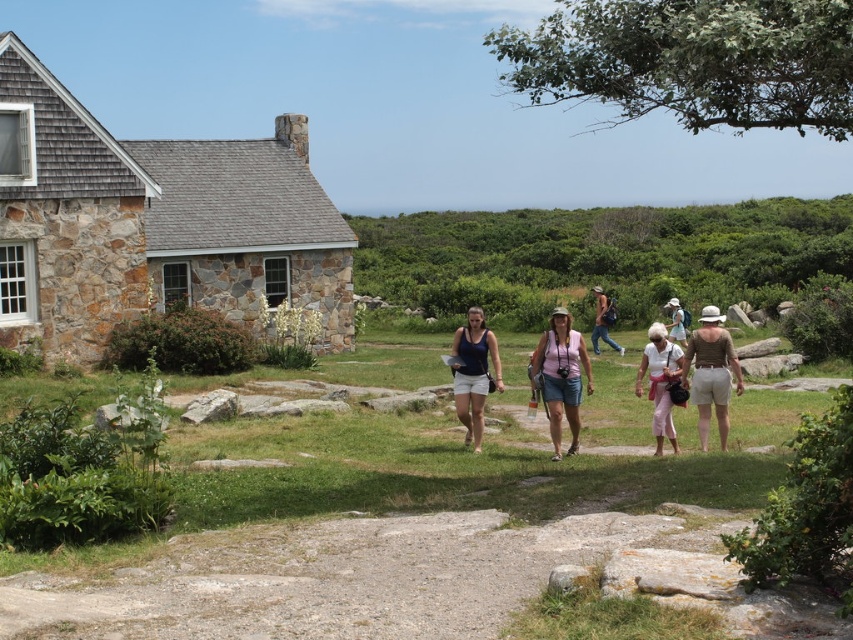
Is pink fabric shirt at center positioned in front of matte white hat at center?

Yes, pink fabric shirt at center is closer to the viewer.

Is point (564, 308) positioned after point (677, 300)?

Yes, it is behind point (677, 300).

What do you see at coordinates (561, 376) in the screenshot? This screenshot has height=640, width=853. I see `pink fabric shirt at center` at bounding box center [561, 376].

Identify the location of pink fabric shirt at center. (x=561, y=376).

In the scene shown: Does stone shingles cottage at left come behind matte pink pants at center?

Yes, stone shingles cottage at left is further from the viewer.

Does point (173, 228) lie in front of point (659, 376)?

That is False.

Image resolution: width=853 pixels, height=640 pixels. In order to click on stone shingles cottage at left in this screenshot , I will do `click(152, 221)`.

Between stone shingles cottage at left and brown cotton shorts at center-right, which one appears on the left side from the viewer's perspective?

From the viewer's perspective, stone shingles cottage at left appears more on the left side.

Is stone shingles cottage at left thinner than brown cotton shorts at center-right?

No.

Measure the distance between point (183, 198) and camera.

The distance of point (183, 198) from camera is 109.88 feet.

Where is `stone shingles cottage at left`? stone shingles cottage at left is located at coordinates (152, 221).